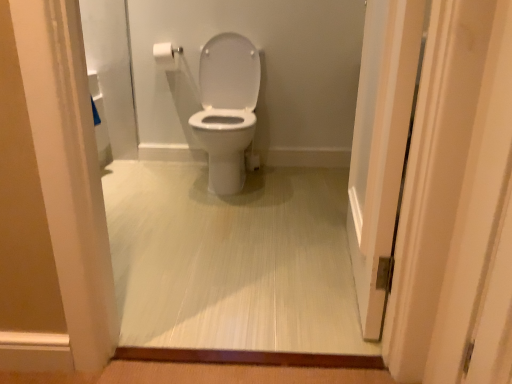
I want to click on white matte toilet paper at upper left, so click(x=166, y=56).

Find the location of a particular element. white matte toilet paper at upper left is located at coordinates (166, 56).

Considering the sizes of objects white glossy door at right and white matte toilet paper at upper left in the image provided, who is smaller, white glossy door at right or white matte toilet paper at upper left?

white matte toilet paper at upper left.

Between white glossy door at right and white matte toilet paper at upper left, which one appears on the left side from the viewer's perspective?

white matte toilet paper at upper left.

From the image's perspective, would you say white glossy door at right is shown under white matte toilet paper at upper left?

Yes.

Where is `screen door to the right of white matte toilet paper at upper left`? This screenshot has width=512, height=384. screen door to the right of white matte toilet paper at upper left is located at coordinates (380, 146).

Would you say white matte toilet paper at upper left is inside or outside white glossy toilet at center?

white matte toilet paper at upper left is outside white glossy toilet at center.

Is white matte toilet paper at upper left not close to white glossy toilet at center?

white matte toilet paper at upper left is far away from white glossy toilet at center.

Does white matte toilet paper at upper left appear on the right side of white glossy toilet at center?

No.

Can you tell me how much white matte toilet paper at upper left and white glossy toilet at center differ in facing direction?

The facing directions of white matte toilet paper at upper left and white glossy toilet at center are 2.45 degrees apart.

Who is shorter, white glossy door at right or white glossy toilet at center?

white glossy toilet at center.

Would you consider white glossy door at right to be distant from white glossy toilet at center?

No, white glossy door at right is not far from white glossy toilet at center.

Is white glossy toilet at center inside white glossy door at right?

No, white glossy toilet at center is not a part of white glossy door at right.

Which object is closer to the camera taking this photo, white glossy door at right or white glossy toilet at center?

white glossy door at right.

This screenshot has width=512, height=384. Identify the location of toilet above the white glossy toilet at center (from a real-world perspective). (227, 108).

From the image's perspective, is white glossy toilet at center above white glossy toilet at center?

Correct, white glossy toilet at center appears higher than white glossy toilet at center in the image.

Based on the photo, which object is further away from the camera, white glossy toilet at center or white glossy toilet at center?

Positioned behind is white glossy toilet at center.

From a real-world perspective, is white glossy toilet at center beneath white glossy toilet at center?

No, from a real-world perspective, white glossy toilet at center is not beneath white glossy toilet at center.

Are white matte toilet paper at upper left and white glossy door at right beside each other?

No, white matte toilet paper at upper left is not next to white glossy door at right.

Who is taller, white matte toilet paper at upper left or white glossy door at right?

white glossy door at right.

Considering the relative sizes of white matte toilet paper at upper left and white glossy door at right in the image provided, is white matte toilet paper at upper left thinner than white glossy door at right?

Yes.

Measure the distance from white matte toilet paper at upper left to white glossy door at right.

The distance of white matte toilet paper at upper left from white glossy door at right is 5.39 feet.

Can you confirm if white glossy door at right is thinner than white glossy toilet at center?

Indeed, white glossy door at right has a lesser width compared to white glossy toilet at center.

Is white glossy door at right closer to camera compared to white glossy toilet at center?

Yes, it is in front of white glossy toilet at center.

From a real-world perspective, which is physically above, white glossy door at right or white glossy toilet at center?

white glossy door at right.

Are white glossy door at right and white glossy toilet at center making contact?

No, white glossy door at right is not beside white glossy toilet at center.

Could you tell me if white glossy toilet at center is turned towards white glossy toilet at center?

No, white glossy toilet at center is not aimed at white glossy toilet at center.

From the image's perspective, is white glossy toilet at center above or below white glossy toilet at center?

From the image's perspective, white glossy toilet at center appears below white glossy toilet at center.

Which object is positioned more to the left, white glossy toilet at center or white glossy toilet at center?

white glossy toilet at center.

Identify the location of screen door below the white matte toilet paper at upper left (from the image's perspective). This screenshot has height=384, width=512. (380, 146).

Where is `corridor directly beneath the white matte toilet paper at upper left (from a real-world perspective)`? The width and height of the screenshot is (512, 384). corridor directly beneath the white matte toilet paper at upper left (from a real-world perspective) is located at coordinates (232, 260).

Based on their spatial positions, is white matte toilet paper at upper left or white glossy toilet at center closer to white glossy door at right?

white glossy toilet at center.

Based on the photo, considering their positions, is white glossy toilet at center positioned further to white glossy toilet at center than white matte toilet paper at upper left?

white matte toilet paper at upper left is positioned further to the anchor white glossy toilet at center.

Estimate the real-world distances between objects in this image. Which object is further from white matte toilet paper at upper left, white glossy door at right or white glossy toilet at center?

white glossy door at right lies further to white matte toilet paper at upper left than the other object.

Which object lies further to the anchor point white glossy toilet at center, white glossy toilet at center or white glossy door at right?

white glossy toilet at center lies further to white glossy toilet at center than the other object.

From the image, which object appears to be farther from white glossy door at right, white glossy toilet at center or white matte toilet paper at upper left?

Based on the image, white matte toilet paper at upper left appears to be further to white glossy door at right.

From the image, which object appears to be farther from white glossy door at right, white glossy toilet at center or white matte toilet paper at upper left?

white matte toilet paper at upper left is further to white glossy door at right.

Looking at the image, which one is located further to white glossy toilet at center, white glossy toilet at center or white glossy door at right?

white glossy door at right is positioned further to the anchor white glossy toilet at center.

Considering their positions, is white glossy toilet at center positioned further to white matte toilet paper at upper left than white glossy door at right?

Based on the image, white glossy door at right appears to be further to white matte toilet paper at upper left.

Where is `toilet between white glossy door at right and white matte toilet paper at upper left along the z-axis`? The height and width of the screenshot is (384, 512). toilet between white glossy door at right and white matte toilet paper at upper left along the z-axis is located at coordinates (227, 108).

I want to click on toilet positioned between white glossy toilet at center and white matte toilet paper at upper left from near to far, so click(x=227, y=108).

Find the location of a particular element. This screenshot has width=512, height=384. corridor located between white glossy door at right and white glossy toilet at center in the depth direction is located at coordinates (232, 260).

At what (x,y) coordinates should I click in order to perform the action: click on corridor located between white glossy door at right and white matte toilet paper at upper left in the depth direction. Please return your answer as a coordinate pair (x, y). The width and height of the screenshot is (512, 384). Looking at the image, I should click on (232, 260).